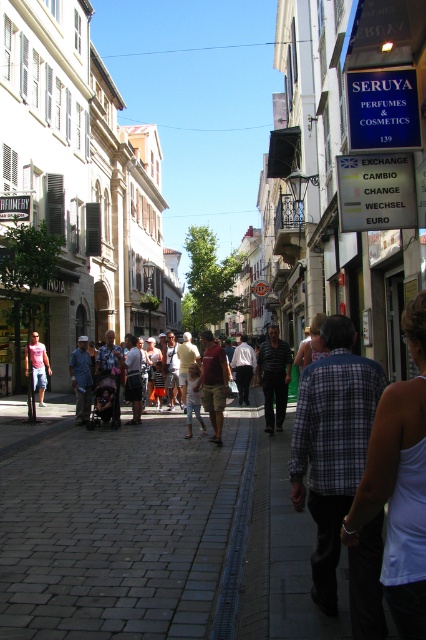
Question: Does gray cobblestone pavement at center come behind matte pink shirt at left?

Choices:
 (A) no
 (B) yes

Answer: (A)

Question: Which point appears farthest from the camera in this image?

Choices:
 (A) (48, 604)
 (B) (42, 353)

Answer: (B)

Question: Does gray cobblestone pavement at center appear on the left side of matte pink shirt at left?

Choices:
 (A) no
 (B) yes

Answer: (A)

Question: Is gray cobblestone pavement at center below matte pink shirt at left?

Choices:
 (A) no
 (B) yes

Answer: (B)